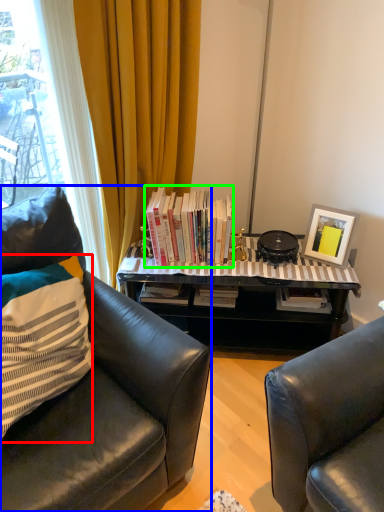
Question: Estimate the real-world distances between objects in this image. Which object is farther from pillow (highlighted by a red box), chair (highlighted by a blue box) or book (highlighted by a green box)?

Choices:
 (A) chair
 (B) book

Answer: (B)